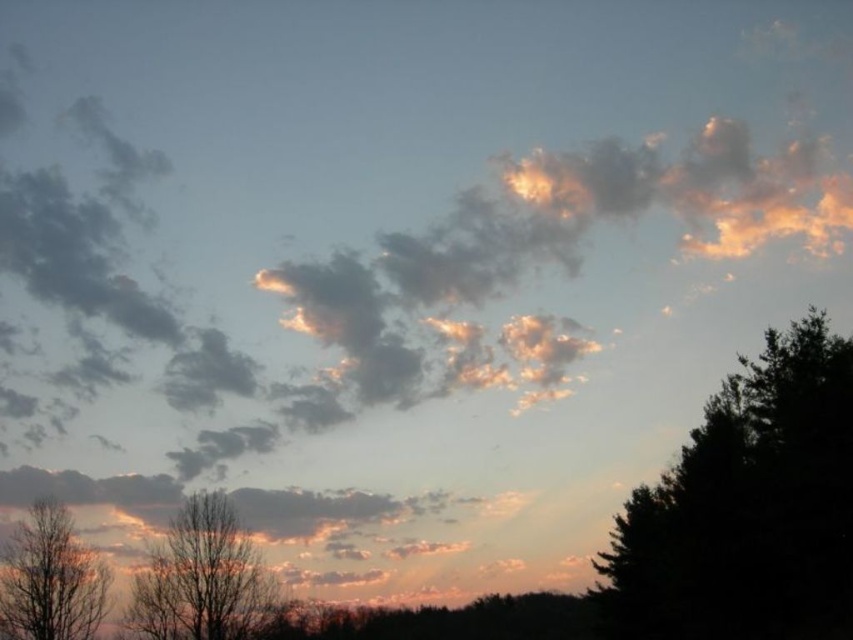
Question: Is dark green leafy tree at right to the left of silvery bark tree at lower left from the viewer's perspective?

Choices:
 (A) yes
 (B) no

Answer: (B)

Question: Considering the real-world distances, which object is farthest from the silvery bark tree at lower left?

Choices:
 (A) bare wood tree at lower left
 (B) dark green leafy tree at right

Answer: (B)

Question: In this image, where is silvery bark tree at lower left located relative to bare wood tree at lower left?

Choices:
 (A) above
 (B) below

Answer: (A)

Question: Can you confirm if dark green leafy tree at right is positioned below silvery bark tree at lower left?

Choices:
 (A) yes
 (B) no

Answer: (B)

Question: Among these points, which one is farthest from the camera?

Choices:
 (A) (844, 589)
 (B) (27, 577)

Answer: (B)

Question: Which of these objects is positioned closest to the dark green leafy tree at right?

Choices:
 (A) silvery bark tree at lower left
 (B) bare wood tree at lower left

Answer: (A)